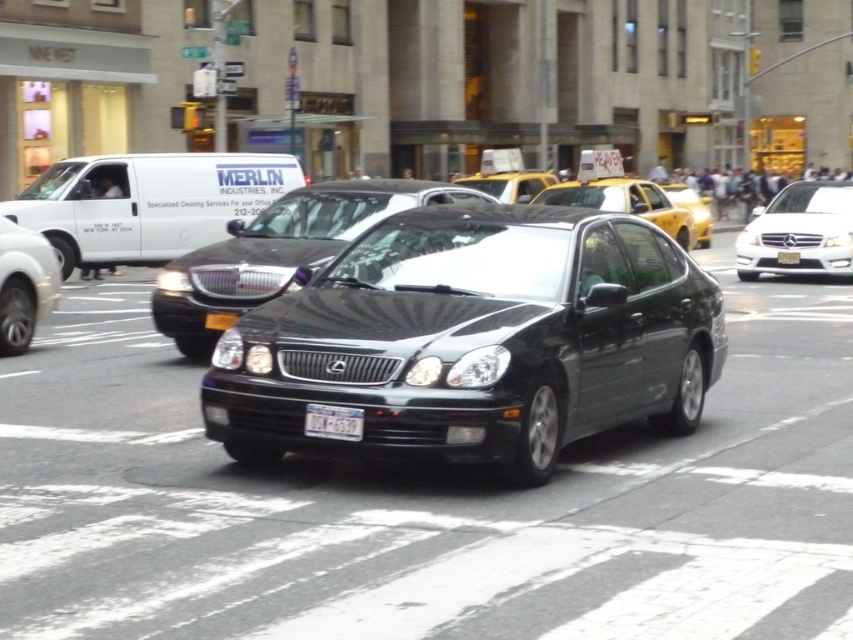
Question: Does black metallic sedan at center have a greater width compared to black plastic license plate at center?

Choices:
 (A) yes
 (B) no

Answer: (A)

Question: Estimate the real-world distances between objects in this image. Which object is farther from the blurred pedestrians at upper right?

Choices:
 (A) shiny silver sedan at left
 (B) white matte van at left
 (C) black metallic sedan at center
 (D) yellow matte taxi at center

Answer: (B)

Question: Is yellow matte taxi at center positioned in front of black plastic license plate at center?

Choices:
 (A) yes
 (B) no

Answer: (B)

Question: Which of the following is the farthest from the observer?

Choices:
 (A) blurred pedestrians at upper right
 (B) white matte van at left
 (C) white glossy sedan at right
 (D) black plastic license plate at center

Answer: (A)

Question: Can you confirm if white plastic license plate at center is positioned to the right of yellow glossy taxi at upper right?

Choices:
 (A) yes
 (B) no

Answer: (B)

Question: Which object appears farthest from the camera in this image?

Choices:
 (A) white matte van at left
 (B) yellow matte taxi at center
 (C) black plastic license plate at center

Answer: (B)